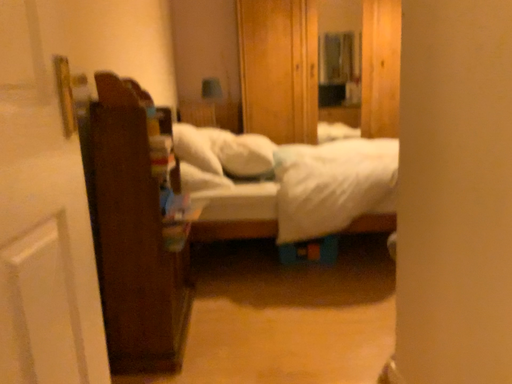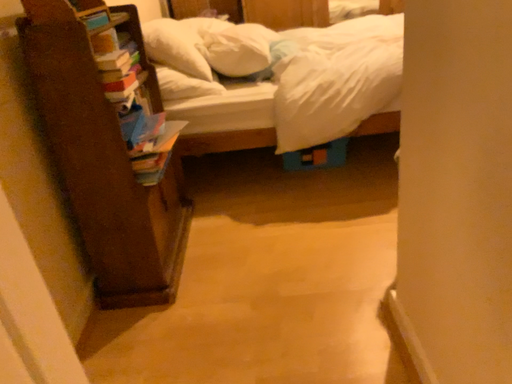
Question: Which way did the camera rotate in the video?

Choices:
 (A) rotated downward
 (B) rotated upward

Answer: (A)